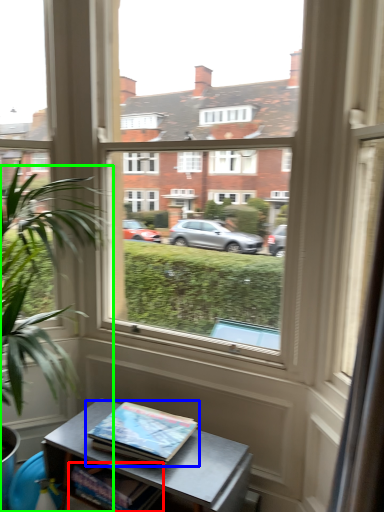
Question: Which object is the farthest from book (highlighted by a red box)? Choose among these: book (highlighted by a blue box) or houseplant (highlighted by a green box).

Choices:
 (A) book
 (B) houseplant

Answer: (B)